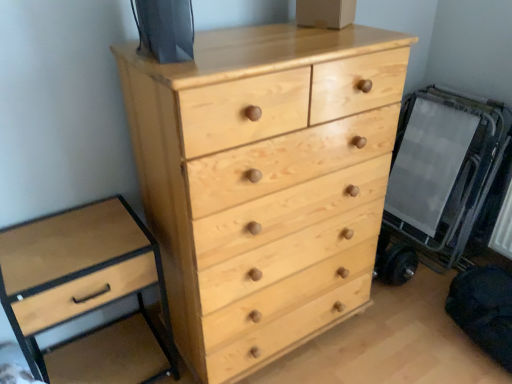
Describe the element at coordinates (265, 182) in the screenshot. I see `natural wood chest of drawers at center, the second chest of drawers from the left` at that location.

In the scene shown: How much space does natural wood chest of drawers at center, which appears as the first chest of drawers when viewed from the right, occupy vertically?

natural wood chest of drawers at center, which appears as the first chest of drawers when viewed from the right, is 3.76 feet in height.

At what (x,y) coordinates should I click in order to perform the action: click on natural wood chest of drawers at center, which appears as the first chest of drawers when viewed from the right. Please return your answer as a coordinate pair (x, y). Looking at the image, I should click on (265, 182).

Image resolution: width=512 pixels, height=384 pixels. Find the location of `light wood/texture drawer at left, which is the 1th chest of drawers from left to right`. light wood/texture drawer at left, which is the 1th chest of drawers from left to right is located at coordinates click(78, 273).

What do you see at coordinates (78, 273) in the screenshot? Image resolution: width=512 pixels, height=384 pixels. I see `light wood/texture drawer at left, the 2th chest of drawers from the right` at bounding box center [78, 273].

Find the location of a particular element. This screenshot has height=384, width=512. natural wood chest of drawers at center, the second chest of drawers from the left is located at coordinates (265, 182).

Considering the relative positions of natural wood chest of drawers at center, the second chest of drawers from the left, and light wood/texture drawer at left, which is the 1th chest of drawers from left to right, in the image provided, is natural wood chest of drawers at center, the second chest of drawers from the left, to the left of light wood/texture drawer at left, which is the 1th chest of drawers from left to right, from the viewer's perspective?

In fact, natural wood chest of drawers at center, the second chest of drawers from the left, is to the right of light wood/texture drawer at left, which is the 1th chest of drawers from left to right.

Consider the image. Between natural wood chest of drawers at center, the second chest of drawers from the left, and light wood/texture drawer at left, the 2th chest of drawers from the right, which one is positioned behind?

light wood/texture drawer at left, the 2th chest of drawers from the right, is behind.

Is point (365, 262) less distant than point (41, 254)?

No, (365, 262) is further to viewer.

From the image's perspective, is natural wood chest of drawers at center, which appears as the first chest of drawers when viewed from the right, above or below light wood/texture drawer at left, the 2th chest of drawers from the right?

From the image's perspective, natural wood chest of drawers at center, which appears as the first chest of drawers when viewed from the right, appears above light wood/texture drawer at left, the 2th chest of drawers from the right.

From a real-world perspective, which is physically above, natural wood chest of drawers at center, which appears as the first chest of drawers when viewed from the right, or light wood/texture drawer at left, the 2th chest of drawers from the right?

natural wood chest of drawers at center, which appears as the first chest of drawers when viewed from the right.

Is natural wood chest of drawers at center, the second chest of drawers from the left, thinner than light wood/texture drawer at left, which is the 1th chest of drawers from left to right?

Result: Incorrect, the width of natural wood chest of drawers at center, the second chest of drawers from the left, is not less than that of light wood/texture drawer at left, which is the 1th chest of drawers from left to right.

Considering the sizes of objects natural wood chest of drawers at center, which appears as the first chest of drawers when viewed from the right, and light wood/texture drawer at left, which is the 1th chest of drawers from left to right, in the image provided, who is taller, natural wood chest of drawers at center, which appears as the first chest of drawers when viewed from the right, or light wood/texture drawer at left, which is the 1th chest of drawers from left to right,?

natural wood chest of drawers at center, which appears as the first chest of drawers when viewed from the right, is taller.

Is natural wood chest of drawers at center, which appears as the first chest of drawers when viewed from the right, bigger or smaller than light wood/texture drawer at left, which is the 1th chest of drawers from left to right?

natural wood chest of drawers at center, which appears as the first chest of drawers when viewed from the right, is bigger than light wood/texture drawer at left, which is the 1th chest of drawers from left to right.

Would you say natural wood chest of drawers at center, which appears as the first chest of drawers when viewed from the right, is outside light wood/texture drawer at left, the 2th chest of drawers from the right?

Yes, natural wood chest of drawers at center, which appears as the first chest of drawers when viewed from the right, is not within light wood/texture drawer at left, the 2th chest of drawers from the right.

Is natural wood chest of drawers at center, which appears as the first chest of drawers when viewed from the right, directly adjacent to light wood/texture drawer at left, the 2th chest of drawers from the right?

natural wood chest of drawers at center, which appears as the first chest of drawers when viewed from the right, and light wood/texture drawer at left, the 2th chest of drawers from the right, are clearly separated.

Is natural wood chest of drawers at center, the second chest of drawers from the left, facing towards light wood/texture drawer at left, which is the 1th chest of drawers from left to right?

No, natural wood chest of drawers at center, the second chest of drawers from the left, is not aimed at light wood/texture drawer at left, which is the 1th chest of drawers from left to right.

Can you tell me how much natural wood chest of drawers at center, the second chest of drawers from the left, and light wood/texture drawer at left, the 2th chest of drawers from the right, differ in facing direction?

The angular difference between natural wood chest of drawers at center, the second chest of drawers from the left, and light wood/texture drawer at left, the 2th chest of drawers from the right, is 0.000186 degrees.

Measure the distance between natural wood chest of drawers at center, which appears as the first chest of drawers when viewed from the right, and light wood/texture drawer at left, which is the 1th chest of drawers from left to right.

natural wood chest of drawers at center, which appears as the first chest of drawers when viewed from the right, is 40.80 centimeters from light wood/texture drawer at left, which is the 1th chest of drawers from left to right.

You are a GUI agent. You are given a task and a screenshot of the screen. Output one action in this format:
    pyautogui.click(x=<x>, y=<y>)
    Task: Click on the chest of drawers that is above the light wood/texture drawer at left, the 2th chest of drawers from the right (from a real-world perspective)
    
    Given the screenshot: What is the action you would take?
    pyautogui.click(x=265, y=182)

Can you confirm if light wood/texture drawer at left, which is the 1th chest of drawers from left to right, is positioned to the right of natural wood chest of drawers at center, which appears as the first chest of drawers when viewed from the right?

In fact, light wood/texture drawer at left, which is the 1th chest of drawers from left to right, is to the left of natural wood chest of drawers at center, which appears as the first chest of drawers when viewed from the right.

Looking at this image, in the image, is light wood/texture drawer at left, the 2th chest of drawers from the right, positioned in front of or behind natural wood chest of drawers at center, the second chest of drawers from the left?

light wood/texture drawer at left, the 2th chest of drawers from the right, is positioned farther from the viewer than natural wood chest of drawers at center, the second chest of drawers from the left.

Which is closer to the camera, (89, 248) or (251, 341)?

Point (89, 248) is positioned closer to the camera compared to point (251, 341).

From the image's perspective, who appears lower, light wood/texture drawer at left, which is the 1th chest of drawers from left to right, or natural wood chest of drawers at center, which appears as the first chest of drawers when viewed from the right?

light wood/texture drawer at left, which is the 1th chest of drawers from left to right, is shown below in the image.

From a real-world perspective, which is physically below, light wood/texture drawer at left, which is the 1th chest of drawers from left to right, or natural wood chest of drawers at center, the second chest of drawers from the left?

light wood/texture drawer at left, which is the 1th chest of drawers from left to right, from a real-world perspective.

Which object is thinner, light wood/texture drawer at left, which is the 1th chest of drawers from left to right, or natural wood chest of drawers at center, the second chest of drawers from the left?

Thinner between the two is light wood/texture drawer at left, which is the 1th chest of drawers from left to right.

Considering the sizes of light wood/texture drawer at left, the 2th chest of drawers from the right, and natural wood chest of drawers at center, the second chest of drawers from the left, in the image, is light wood/texture drawer at left, the 2th chest of drawers from the right, taller or shorter than natural wood chest of drawers at center, the second chest of drawers from the left,?

light wood/texture drawer at left, the 2th chest of drawers from the right, is shorter than natural wood chest of drawers at center, the second chest of drawers from the left.

Is light wood/texture drawer at left, which is the 1th chest of drawers from left to right, bigger or smaller than natural wood chest of drawers at center, which appears as the first chest of drawers when viewed from the right?

Considering their sizes, light wood/texture drawer at left, which is the 1th chest of drawers from left to right, takes up less space than natural wood chest of drawers at center, which appears as the first chest of drawers when viewed from the right.

Is light wood/texture drawer at left, the 2th chest of drawers from the right, inside or outside of natural wood chest of drawers at center, the second chest of drawers from the left?

light wood/texture drawer at left, the 2th chest of drawers from the right, cannot be found inside natural wood chest of drawers at center, the second chest of drawers from the left.

Is light wood/texture drawer at left, which is the 1th chest of drawers from left to right, far from natural wood chest of drawers at center, the second chest of drawers from the left?

light wood/texture drawer at left, which is the 1th chest of drawers from left to right, is actually quite close to natural wood chest of drawers at center, the second chest of drawers from the left.

Is light wood/texture drawer at left, the 2th chest of drawers from the right, positioned with its back to natural wood chest of drawers at center, which appears as the first chest of drawers when viewed from the right?

light wood/texture drawer at left, the 2th chest of drawers from the right, does not have its back to natural wood chest of drawers at center, which appears as the first chest of drawers when viewed from the right.

How many degrees apart are the facing directions of light wood/texture drawer at left, the 2th chest of drawers from the right, and natural wood chest of drawers at center, the second chest of drawers from the left?

0.000186 degrees.

Measure the distance from light wood/texture drawer at left, which is the 1th chest of drawers from left to right, to natural wood chest of drawers at center, which appears as the first chest of drawers when viewed from the right.

The distance of light wood/texture drawer at left, which is the 1th chest of drawers from left to right, from natural wood chest of drawers at center, which appears as the first chest of drawers when viewed from the right, is 16.06 inches.

Locate an element on the screen. The image size is (512, 384). the chest of drawers below the natural wood chest of drawers at center, which appears as the first chest of drawers when viewed from the right (from the image's perspective) is located at coordinates click(x=78, y=273).

Image resolution: width=512 pixels, height=384 pixels. I want to click on chest of drawers behind the natural wood chest of drawers at center, the second chest of drawers from the left, so click(78, 273).

Where is `chest of drawers lying on the right of light wood/texture drawer at left, which is the 1th chest of drawers from left to right`? The width and height of the screenshot is (512, 384). chest of drawers lying on the right of light wood/texture drawer at left, which is the 1th chest of drawers from left to right is located at coordinates [265, 182].